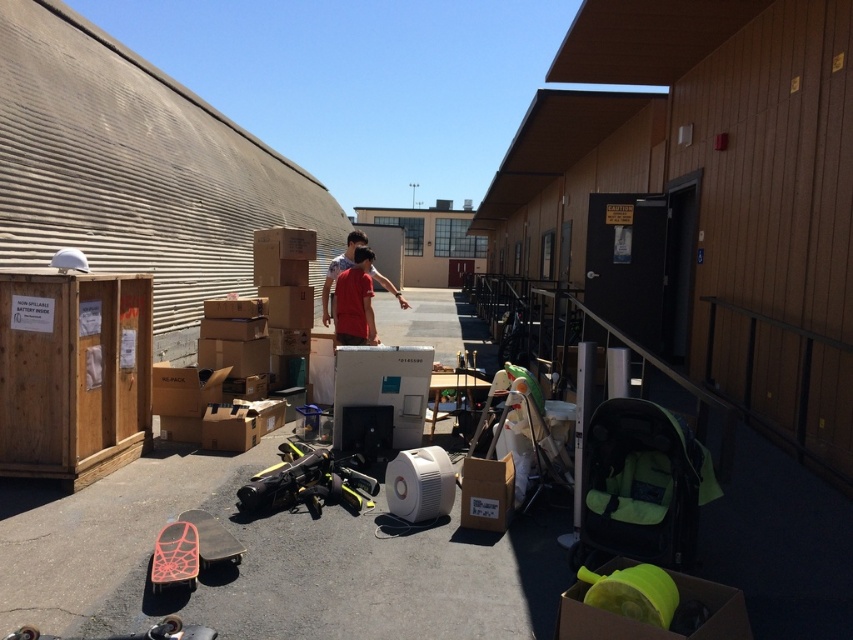
From the picture: You are a delivery person who just arrived at the courtyard. You need to place a new item between the matte green plastic bucket at lower right and the brown cardboard box at center. Can you fit it there?

The matte green plastic bucket at lower right is in front of the brown cardboard box at center, so there is space between them where you can place the new item.

In the scene shown: You are standing at the origin point of the coordinate system in the image. The matte green plastic bucket at lower right is located at coordinates approximately 0.977 on the x axis and 0.762 on the y axis. If you want to move directly towards it, which direction should you head in?

The matte green plastic bucket at lower right is located at coordinates approximately 0.977 on the x axis and 0.762 on the y axis. Since the origin is at the bottom left corner of the image, moving towards increasing x and y values would mean heading towards the upper right direction. However, since the bucket is at lower right, the y coordinate is relatively low compared to the maximum possible y value. Therefore, to reach the bucket, you should move towards the right and slightly upwards from the origin.